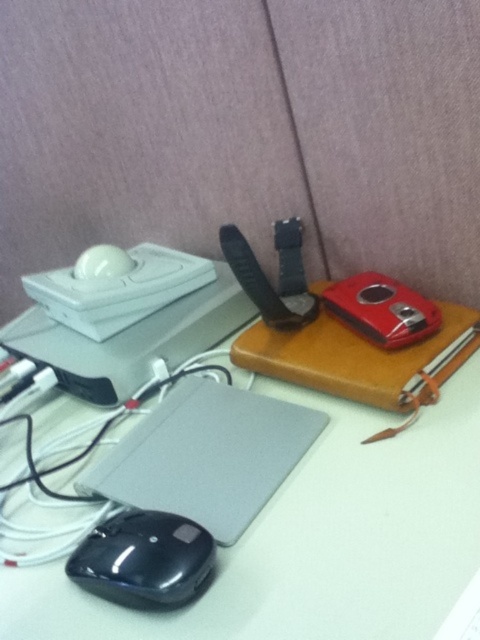
Which is more to the left, white matte table at center or satin black laptop at lower left?

From the viewer's perspective, satin black laptop at lower left appears more on the left side.

Does white matte table at center have a greater height compared to satin black laptop at lower left?

Correct, white matte table at center is much taller as satin black laptop at lower left.

Does point (32, 598) come closer to viewer compared to point (171, 397)?

Yes, it is in front of point (171, 397).

You are a GUI agent. You are given a task and a screenshot of the screen. Output one action in this format:
    pyautogui.click(x=<x>, y=<y>)
    Task: Click on the white matte table at center
    The height and width of the screenshot is (640, 480).
    Given the screenshot: What is the action you would take?
    pyautogui.click(x=363, y=529)

Is white matte table at center shorter than black matte mouse at lower left?

In fact, white matte table at center may be taller than black matte mouse at lower left.

Locate an element on the screen. The height and width of the screenshot is (640, 480). white matte table at center is located at coordinates (363, 529).

Who is more distant from viewer, (x=286, y=540) or (x=94, y=536)?

The point (x=94, y=536) is behind.

Image resolution: width=480 pixels, height=640 pixels. What are the coordinates of `white matte table at center` in the screenshot? It's located at (363, 529).

Is the position of satin black laptop at lower left less distant than that of black matte mouse at lower left?

That is False.

Who is taller, satin black laptop at lower left or black matte mouse at lower left?

satin black laptop at lower left

Is point (238, 451) more distant than point (136, 573)?

Yes, point (238, 451) is farther from viewer.

Where is `satin black laptop at lower left`? The image size is (480, 640). satin black laptop at lower left is located at coordinates (207, 456).